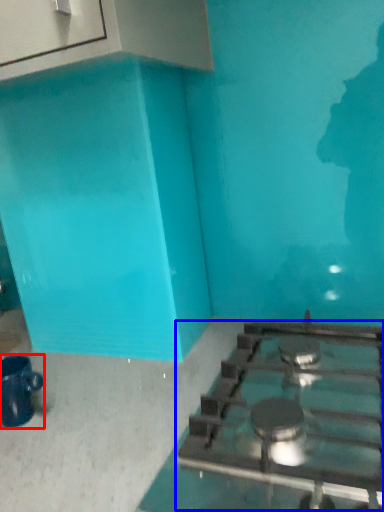
Question: Among these objects, which one is nearest to the camera, coffee cup (highlighted by a red box) or gas stove (highlighted by a blue box)?

Choices:
 (A) coffee cup
 (B) gas stove

Answer: (B)